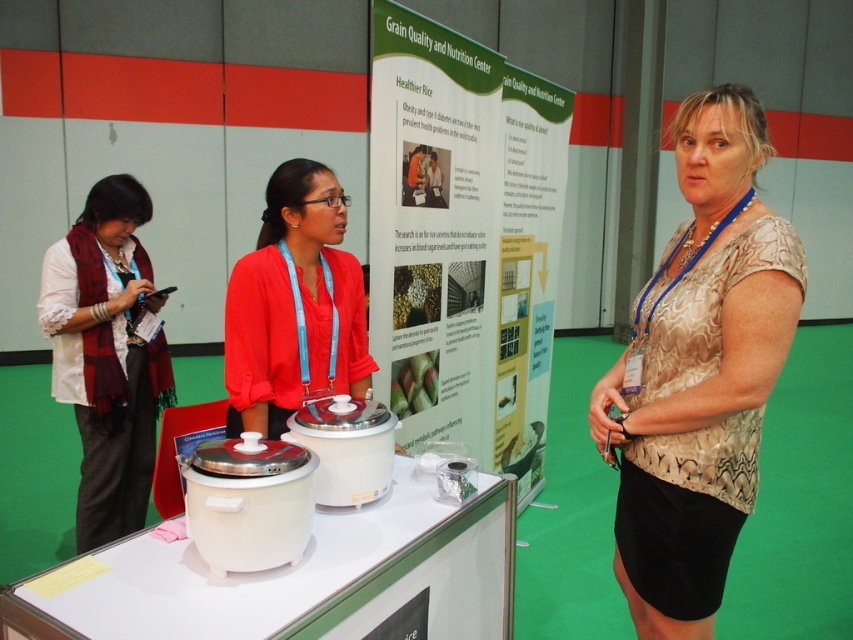
Question: Which point is farther from the camera taking this photo?

Choices:
 (A) (267, 308)
 (B) (65, 323)

Answer: (B)

Question: Which object is positioned farthest from the gold textured blouse at center?

Choices:
 (A) matte red blouse at center
 (B) matte white scarf at left

Answer: (B)

Question: Which point is closer to the camera taking this photo?

Choices:
 (A) (519, 225)
 (B) (51, 378)

Answer: (B)

Question: Observing the image, what is the correct spatial positioning of green paperboard poster at center in reference to matte white scarf at left?

Choices:
 (A) left
 (B) right

Answer: (B)

Question: Can you confirm if gold textured blouse at center is bigger than matte white scarf at left?

Choices:
 (A) yes
 (B) no

Answer: (A)

Question: Does green paperboard poster at center come in front of matte red blouse at center?

Choices:
 (A) no
 (B) yes

Answer: (A)